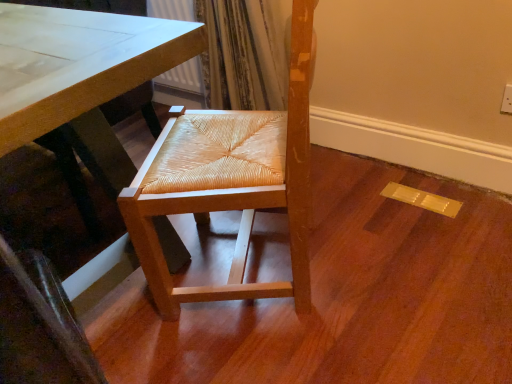
The width and height of the screenshot is (512, 384). Find the location of `free space below natural wood woven seat at center (from a real-world perspective)`. free space below natural wood woven seat at center (from a real-world perspective) is located at coordinates (248, 258).